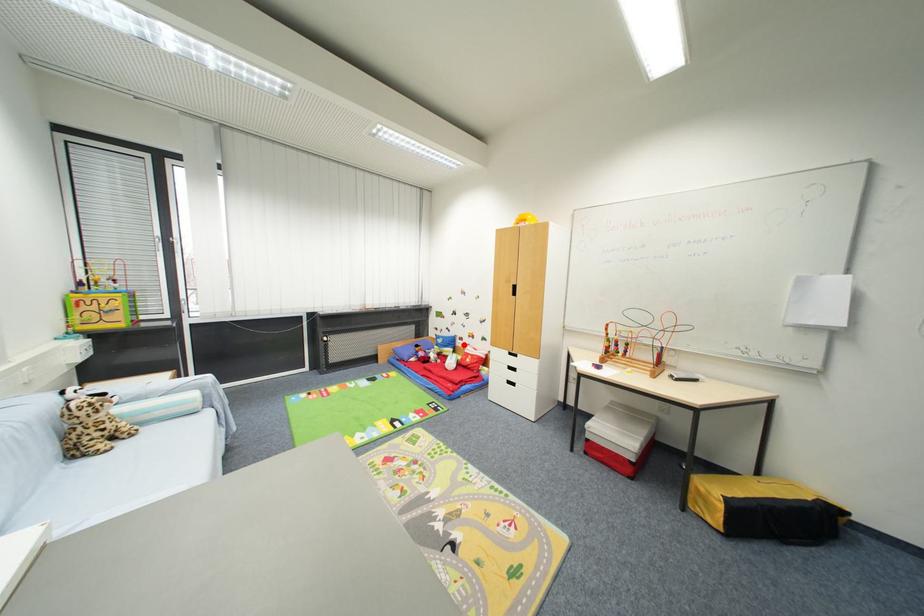
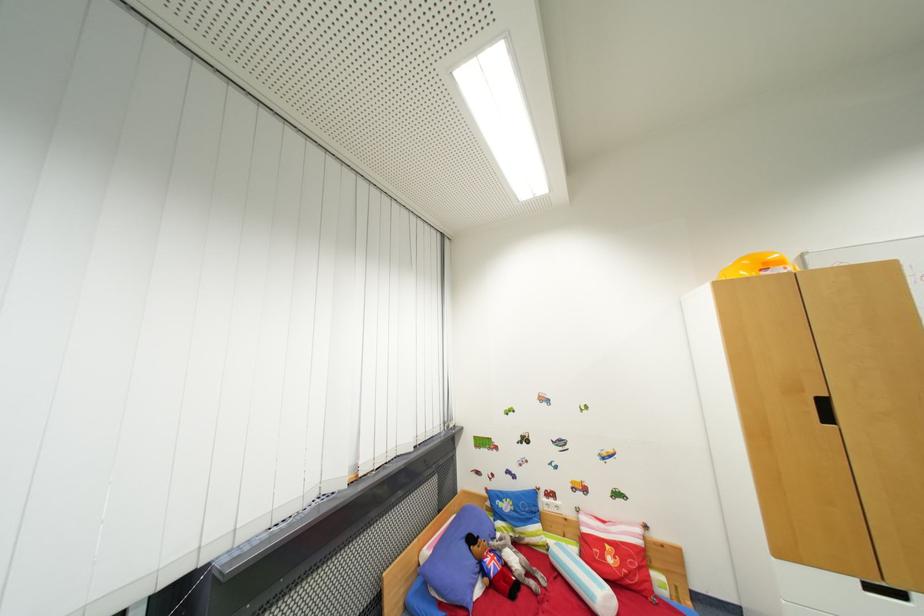
Locate, in the second image, the point that corresponds to the highlighted location in the first image.

(550, 506)